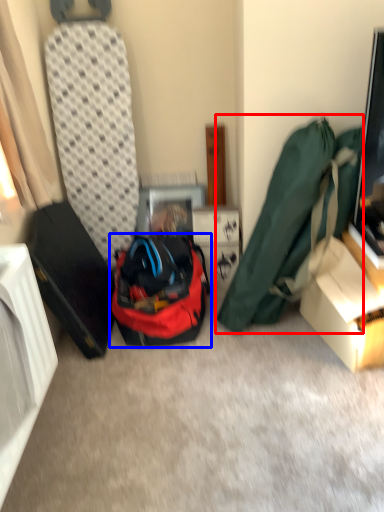
Question: Which point is further to the camera, luggage and bags (highlighted by a red box) or backpack (highlighted by a blue box)?

Choices:
 (A) luggage and bags
 (B) backpack

Answer: (B)